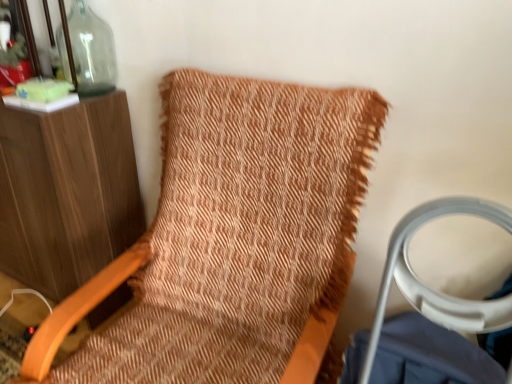
What do you see at coordinates (232, 238) in the screenshot?
I see `textured orange fabric bean bag chair at center` at bounding box center [232, 238].

At what (x,y) coordinates should I click in order to perform the action: click on textured orange fabric bean bag chair at center. Please return your answer as a coordinate pair (x, y). This screenshot has height=384, width=512. Looking at the image, I should click on (232, 238).

Describe the element at coordinates (88, 51) in the screenshot. This screenshot has width=512, height=384. I see `transparent glass bottle at upper left` at that location.

I want to click on transparent glass bottle at upper left, so click(x=88, y=51).

Identify the location of textured orange fabric bean bag chair at center. pos(232,238).

Considering the relative positions of transparent glass bottle at upper left and textured orange fabric bean bag chair at center in the image provided, is transparent glass bottle at upper left to the left of textured orange fabric bean bag chair at center from the viewer's perspective?

Yes, transparent glass bottle at upper left is to the left of textured orange fabric bean bag chair at center.

In the image, is transparent glass bottle at upper left positioned in front of or behind textured orange fabric bean bag chair at center?

Visually, transparent glass bottle at upper left is located behind textured orange fabric bean bag chair at center.

Which is behind, point (72, 20) or point (35, 360)?

Positioned behind is point (72, 20).

From the image's perspective, is transparent glass bottle at upper left located above or below textured orange fabric bean bag chair at center?

Based on their image positions, transparent glass bottle at upper left is located above textured orange fabric bean bag chair at center.

Consider the image. From a real-world perspective, relative to textured orange fabric bean bag chair at center, is transparent glass bottle at upper left vertically above or below?

transparent glass bottle at upper left is situated higher than textured orange fabric bean bag chair at center in the real world.

Is transparent glass bottle at upper left thinner than textured orange fabric bean bag chair at center?

Indeed, transparent glass bottle at upper left has a lesser width compared to textured orange fabric bean bag chair at center.

Considering the relative sizes of transparent glass bottle at upper left and textured orange fabric bean bag chair at center in the image provided, is transparent glass bottle at upper left shorter than textured orange fabric bean bag chair at center?

Yes, transparent glass bottle at upper left is shorter than textured orange fabric bean bag chair at center.

Considering the relative sizes of transparent glass bottle at upper left and textured orange fabric bean bag chair at center in the image provided, is transparent glass bottle at upper left bigger than textured orange fabric bean bag chair at center?

No.

From the picture: Would you say transparent glass bottle at upper left is inside or outside textured orange fabric bean bag chair at center?

transparent glass bottle at upper left exists outside the volume of textured orange fabric bean bag chair at center.

Is transparent glass bottle at upper left not near textured orange fabric bean bag chair at center?

transparent glass bottle at upper left is near textured orange fabric bean bag chair at center, not far away.

Is transparent glass bottle at upper left looking in the opposite direction of textured orange fabric bean bag chair at center?

No, textured orange fabric bean bag chair at center is not at the back of transparent glass bottle at upper left.

How many degrees apart are the facing directions of transparent glass bottle at upper left and textured orange fabric bean bag chair at center?

They differ by 5.49 degrees in their facing directions.

How far apart are transparent glass bottle at upper left and textured orange fabric bean bag chair at center?

transparent glass bottle at upper left is 28.51 inches away from textured orange fabric bean bag chair at center.

The width and height of the screenshot is (512, 384). What are the coordinates of `bottle on the left of the textured orange fabric bean bag chair at center` in the screenshot? It's located at (88, 51).

Is textured orange fabric bean bag chair at center to the right of transparent glass bottle at upper left from the viewer's perspective?

Yes, textured orange fabric bean bag chair at center is to the right of transparent glass bottle at upper left.

Between textured orange fabric bean bag chair at center and transparent glass bottle at upper left, which one is positioned behind?

transparent glass bottle at upper left is further away from the camera.

Which is behind, point (308, 110) or point (75, 14)?

The point (75, 14) is more distant.

From the image's perspective, is textured orange fabric bean bag chair at center beneath transparent glass bottle at upper left?

Correct, textured orange fabric bean bag chair at center appears lower than transparent glass bottle at upper left in the image.

From a real-world perspective, which object stands above the other?

From a 3D spatial view, transparent glass bottle at upper left is above.

Based on the photo, which of these two, textured orange fabric bean bag chair at center or transparent glass bottle at upper left, is wider?

textured orange fabric bean bag chair at center.

Considering the sizes of objects textured orange fabric bean bag chair at center and transparent glass bottle at upper left in the image provided, who is shorter, textured orange fabric bean bag chair at center or transparent glass bottle at upper left?

With less height is transparent glass bottle at upper left.

Is textured orange fabric bean bag chair at center smaller than transparent glass bottle at upper left?

No.

In the scene shown: Can we say textured orange fabric bean bag chair at center lies outside transparent glass bottle at upper left?

Indeed, textured orange fabric bean bag chair at center is completely outside transparent glass bottle at upper left.

Is there a large distance between textured orange fabric bean bag chair at center and transparent glass bottle at upper left?

Actually, textured orange fabric bean bag chair at center and transparent glass bottle at upper left are a little close together.

Is transparent glass bottle at upper left at the back of textured orange fabric bean bag chair at center?

No, textured orange fabric bean bag chair at center is not facing away from transparent glass bottle at upper left.

Consider the image. Can you tell me how much textured orange fabric bean bag chair at center and transparent glass bottle at upper left differ in facing direction?

5.49 degrees.

Find the location of a particular element. Image resolution: width=512 pixels, height=384 pixels. bean bag chair on the right side of transparent glass bottle at upper left is located at coordinates (x=232, y=238).

Where is `bean bag chair below the transparent glass bottle at upper left (from a real-world perspective)`? bean bag chair below the transparent glass bottle at upper left (from a real-world perspective) is located at coordinates (232, 238).

Where is `bean bag chair in front of the transparent glass bottle at upper left`? The width and height of the screenshot is (512, 384). bean bag chair in front of the transparent glass bottle at upper left is located at coordinates (232, 238).